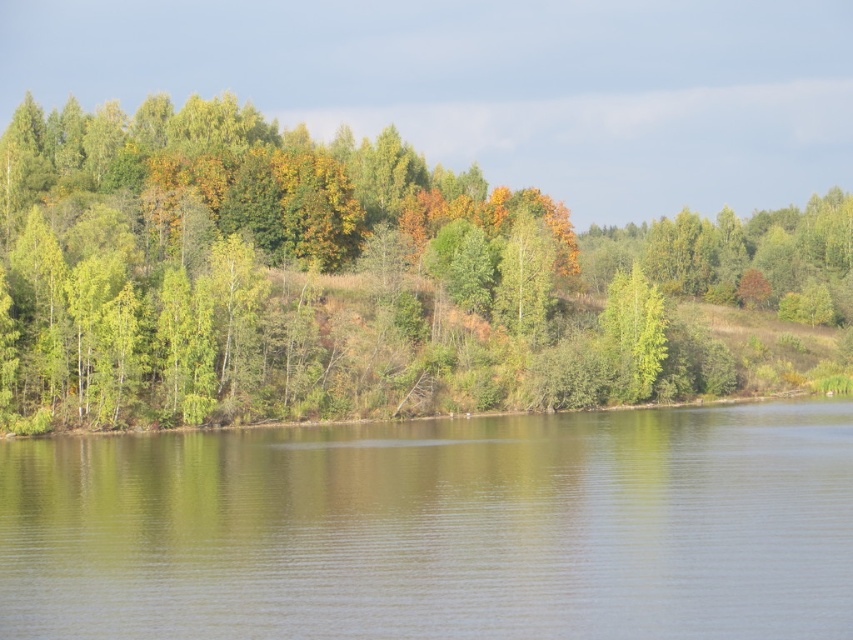
Question: Which point is farther from the camera taking this photo?

Choices:
 (A) (128, 531)
 (B) (650, 348)
 (C) (236, 285)

Answer: (B)

Question: Which point is farther to the camera?

Choices:
 (A) green matte tree at center
 (B) green reflective water at center

Answer: (A)

Question: Is green leafy trees at center below green reflective water at center?

Choices:
 (A) yes
 (B) no

Answer: (B)

Question: Is green reflective water at center positioned behind green matte tree at center?

Choices:
 (A) yes
 (B) no

Answer: (B)

Question: Is green leafy trees at center bigger than green reflective water at center?

Choices:
 (A) yes
 (B) no

Answer: (A)

Question: Which of the following is the closest to the observer?

Choices:
 (A) green leafy trees at center
 (B) green reflective water at center

Answer: (B)